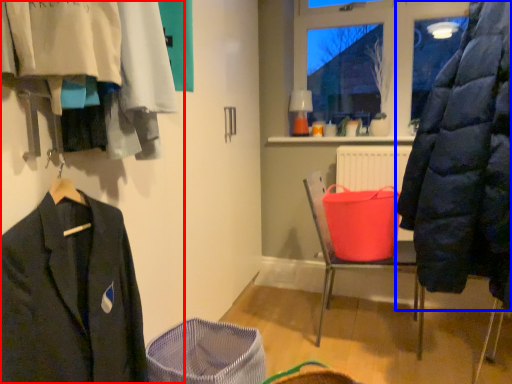
Question: Which of the following is the farthest to the observer, closet (highlighted by a red box) or coat (highlighted by a blue box)?

Choices:
 (A) closet
 (B) coat

Answer: (B)